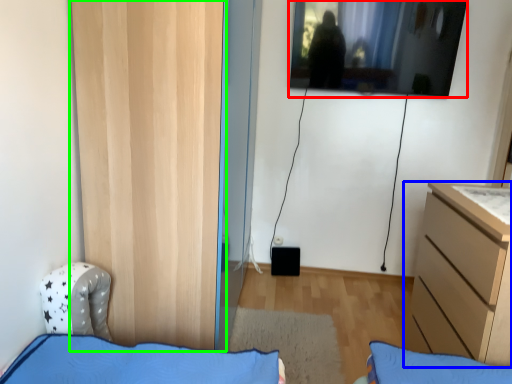
Question: Considering the real-world distances, which object is closest to window (highlighted by a red box)? chest of drawers (highlighted by a blue box) or door (highlighted by a green box).

Choices:
 (A) chest of drawers
 (B) door

Answer: (A)